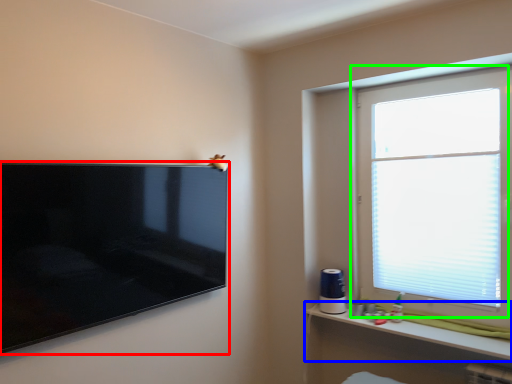
Question: Which object is the farthest from television (highlighted by a red box)? Choose among these: shelf (highlighted by a blue box) or window (highlighted by a green box).

Choices:
 (A) shelf
 (B) window

Answer: (B)